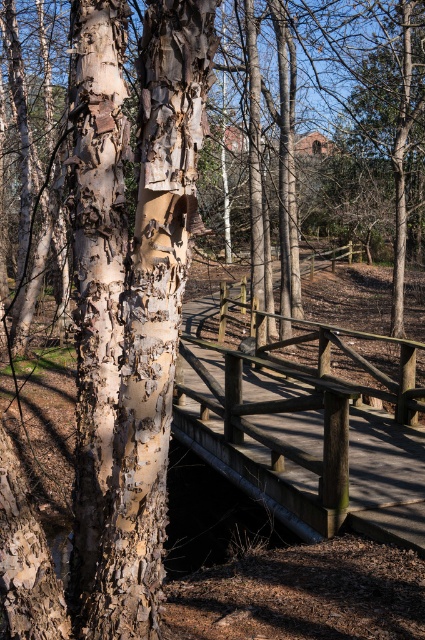
Which is behind, point (197, 125) or point (388, 509)?

The point (388, 509) is behind.

Can you confirm if white bark tree trunk at center is smaller than wooden bridge at center?

Yes, white bark tree trunk at center is smaller than wooden bridge at center.

Does point (99, 378) come behind point (419, 436)?

No, (99, 378) is in front of (419, 436).

Locate an element on the screen. white bark tree trunk at center is located at coordinates (130, 300).